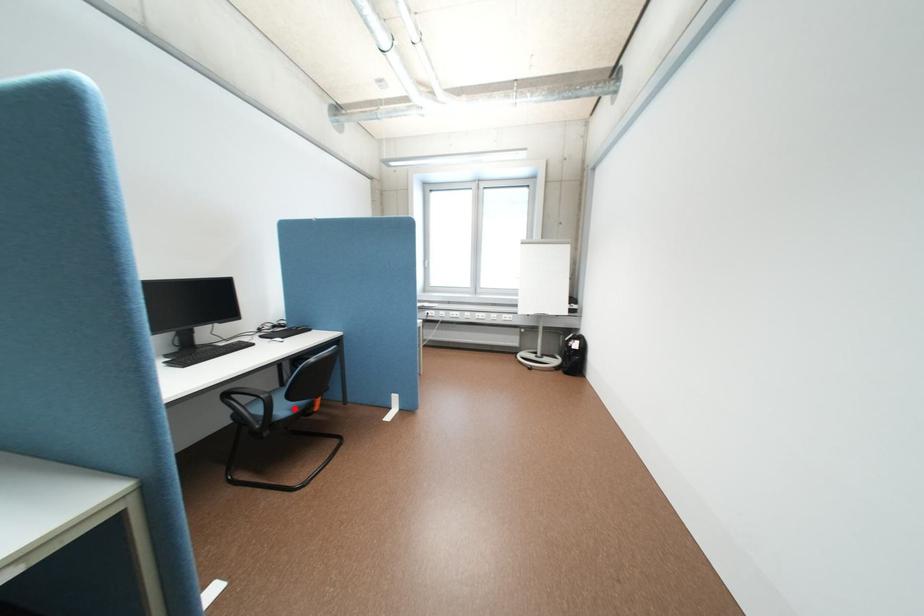
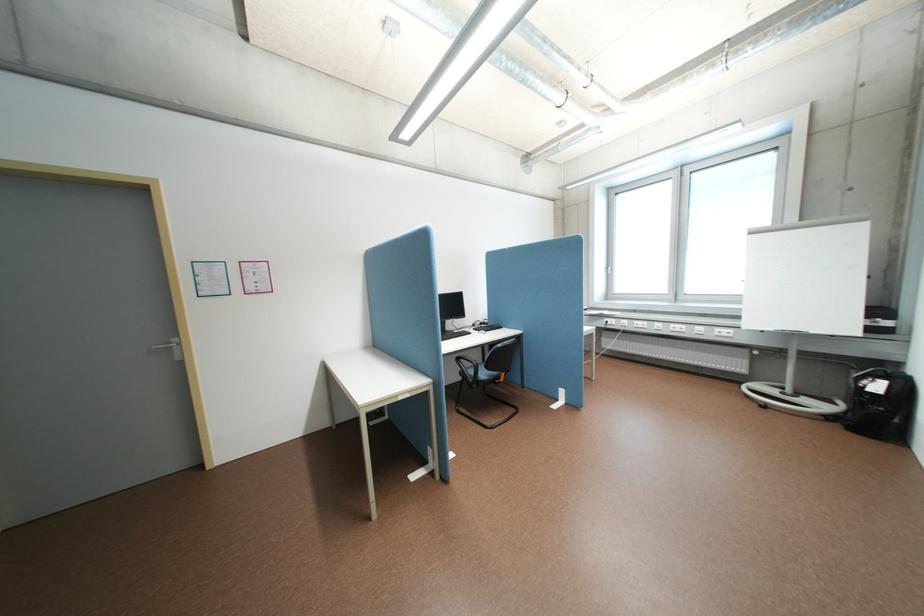
Find the pixel in the second image that matches the highlighted location in the first image.

(494, 374)